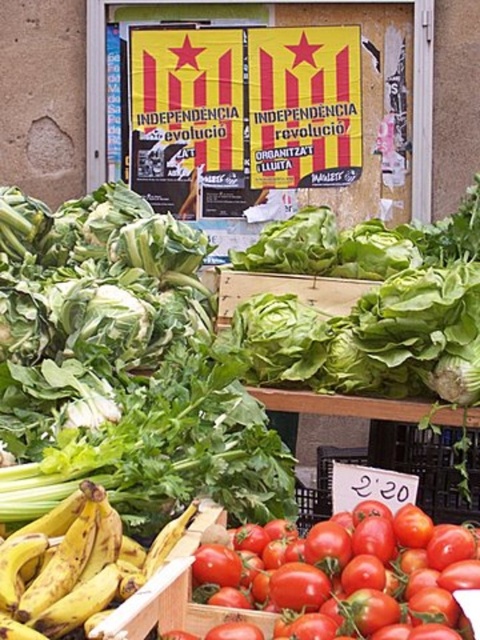
You are a customer at the market and want to buy both the shiny red tomato at lower center and the yellow matte bananas at lower left. If you start from the bananas, in which direction should you move to reach the tomatoes?

The shiny red tomato at lower center is to the right of the yellow matte bananas at lower left, so you should move to the right to reach the tomatoes from the bananas.

What is located at the coordinates point (252,100) in the market scene?

The point (252,100) is on a yellowstriped fabric poster at upper center.